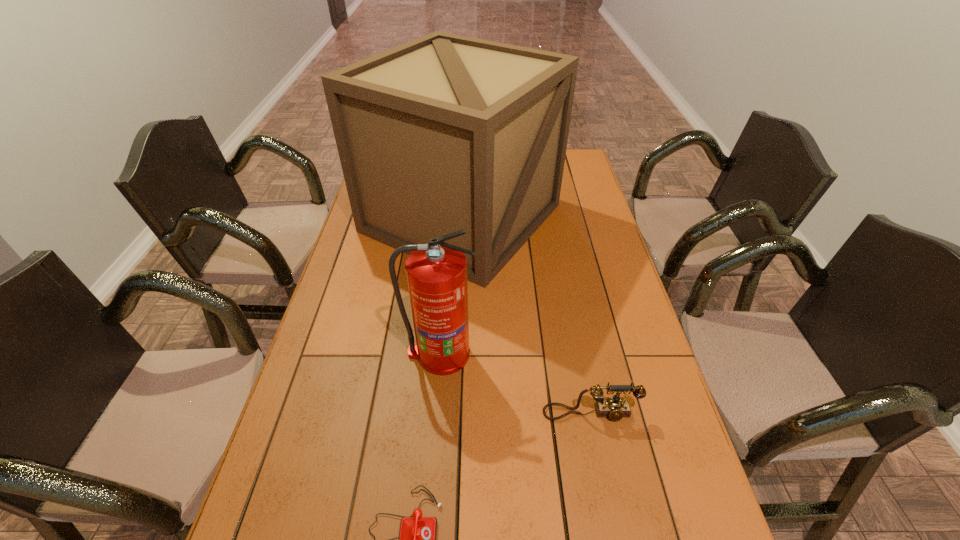
Where is `free space between the farthest object and the farther telephone`? free space between the farthest object and the farther telephone is located at coordinates (526, 315).

Point out which object is positioned as the third nearest to the nearest object. Please provide its 2D coordinates. Your answer should be formatted as a tuple, i.e. [(x, y)], where the tuple contains the x and y coordinates of a point satisfying the conditions above.

[(446, 132)]

Identify which object is the nearest to the shorter telephone. Please provide its 2D coordinates. Your answer should be formatted as a tuple, i.e. [(x, y)], where the tuple contains the x and y coordinates of a point satisfying the conditions above.

[(614, 408)]